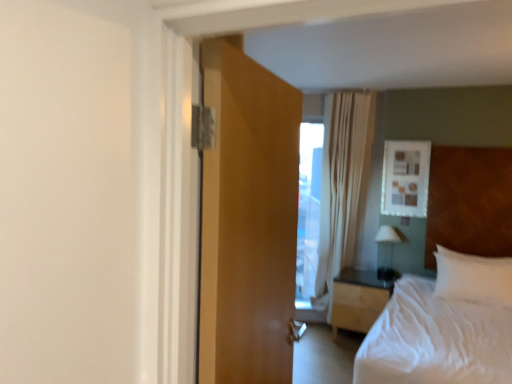
Question: From a real-world perspective, is white sheer curtain at upper center physically below white glossy lamp at right?

Choices:
 (A) no
 (B) yes

Answer: (A)

Question: From the image's perspective, is white sheer curtain at upper center above white glossy lamp at right?

Choices:
 (A) yes
 (B) no

Answer: (A)

Question: Can you confirm if white sheer curtain at upper center is wider than white glossy lamp at right?

Choices:
 (A) yes
 (B) no

Answer: (B)

Question: Is white sheer curtain at upper center positioned beyond the bounds of white glossy lamp at right?

Choices:
 (A) no
 (B) yes

Answer: (B)

Question: Is white sheer curtain at upper center further to the viewer compared to white glossy lamp at right?

Choices:
 (A) yes
 (B) no

Answer: (A)

Question: From a real-world perspective, is white sheer curtain at upper center positioned above or below white soft bed at right?

Choices:
 (A) above
 (B) below

Answer: (A)

Question: Is white sheer curtain at upper center to the left or to the right of white soft bed at right in the image?

Choices:
 (A) right
 (B) left

Answer: (B)

Question: Looking at their shapes, would you say white sheer curtain at upper center is wider or thinner than white soft bed at right?

Choices:
 (A) wide
 (B) thin

Answer: (B)

Question: From the image's perspective, is white sheer curtain at upper center above or below white soft bed at right?

Choices:
 (A) above
 (B) below

Answer: (A)

Question: Is white soft pillow at right in front of or behind white sheer curtain at upper center in the image?

Choices:
 (A) front
 (B) behind

Answer: (A)

Question: Based on their sizes in the image, would you say white soft pillow at right is bigger or smaller than white sheer curtain at upper center?

Choices:
 (A) small
 (B) big

Answer: (A)

Question: Looking at their shapes, would you say white soft pillow at right is wider or thinner than white sheer curtain at upper center?

Choices:
 (A) wide
 (B) thin

Answer: (A)

Question: Is point (445, 268) closer or farther from the camera than point (359, 180)?

Choices:
 (A) closer
 (B) farther

Answer: (A)

Question: Considering their positions, is light wood/wooden nightstand at center located in front of or behind white soft pillow at right?

Choices:
 (A) behind
 (B) front

Answer: (A)

Question: Considering the positions of light wood/wooden nightstand at center and white soft pillow at right in the image, is light wood/wooden nightstand at center wider or thinner than white soft pillow at right?

Choices:
 (A) wide
 (B) thin

Answer: (A)